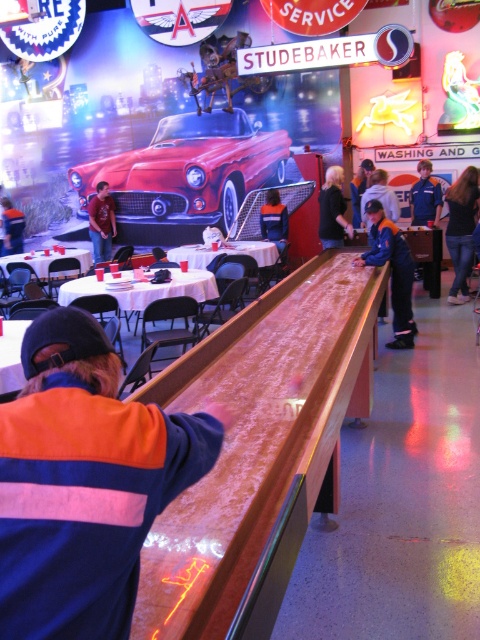
Question: Among these points, which one is nearest to the camera?

Choices:
 (A) (21, 321)
 (B) (371, 257)
 (C) (228, 156)

Answer: (A)

Question: Is orange reflective jacket at center to the left of blue denim jacket at center from the viewer's perspective?

Choices:
 (A) no
 (B) yes

Answer: (B)

Question: Among these objects, which one is nearest to the camera?

Choices:
 (A) white plastic table at center
 (B) orange reflective jacket at center
 (C) wooden table at center
 (D) white glossy table at left

Answer: (C)

Question: Which object is closer to the camera taking this photo?

Choices:
 (A) orange and blue jacket at center
 (B) wooden table at center
 (C) white plastic table at center
 (D) wooden bar at center

Answer: (A)

Question: Can you confirm if orange reflective jacket at center is positioned below white glossy table at left?

Choices:
 (A) no
 (B) yes

Answer: (B)

Question: Does white plastic table at center come behind white glossy table at left?

Choices:
 (A) yes
 (B) no

Answer: (B)